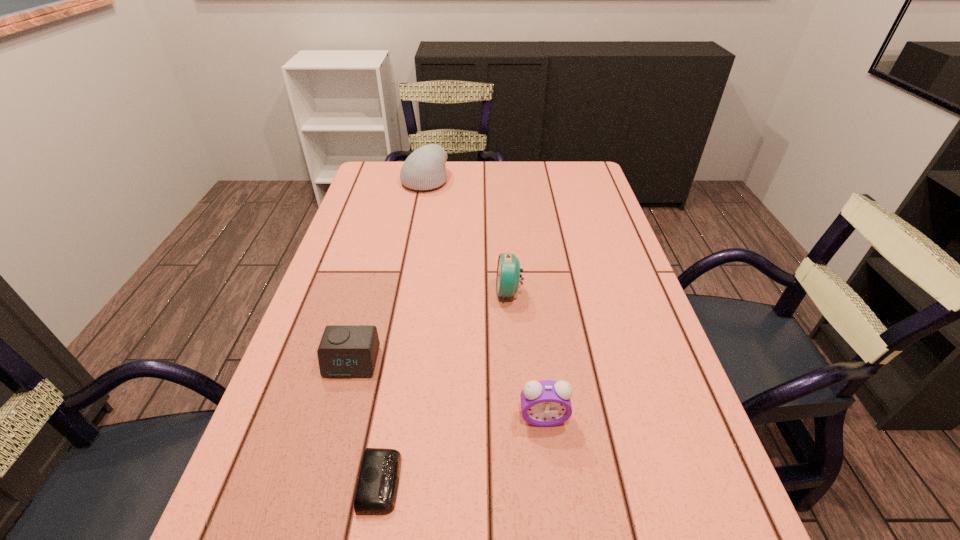
This screenshot has height=540, width=960. In order to click on blank region between the third farthest alarm clock and the beanie in this screenshot , I will do `click(484, 299)`.

Locate an element on the screen. This screenshot has width=960, height=540. blank region between the farthest object and the shortest object is located at coordinates (402, 331).

At what (x,y) coordinates should I click in order to perform the action: click on vacant area that lies between the farthest alarm clock and the nearest alarm clock. Please return your answer as a coordinate pair (x, y). Looking at the image, I should click on (444, 387).

Select which object appears as the third closest to the farthest alarm clock. Please provide its 2D coordinates. Your answer should be formatted as a tuple, i.e. [(x, y)], where the tuple contains the x and y coordinates of a point satisfying the conditions above.

[(376, 492)]

Image resolution: width=960 pixels, height=540 pixels. Identify the location of object that stands as the second closest to the third farthest alarm clock. (508, 275).

At what (x,y) coordinates should I click in order to perform the action: click on alarm clock that is the second closest to the shortest object. Please return your answer as a coordinate pair (x, y). Image resolution: width=960 pixels, height=540 pixels. Looking at the image, I should click on (545, 403).

Identify which alarm clock is the third nearest to the second nearest alarm clock. Please provide its 2D coordinates. Your answer should be formatted as a tuple, i.e. [(x, y)], where the tuple contains the x and y coordinates of a point satisfying the conditions above.

[(345, 351)]

Find the location of a particular element. free spot that satisfies the following two spatial constraints: 1. on the face of the third farthest alarm clock; 2. on the display of the nearest alarm clock is located at coordinates (551, 482).

Find the location of a particular element. vacant space that satisfies the following two spatial constraints: 1. on the front-facing side of the second farthest object; 2. on the front-facing side of the third nearest alarm clock is located at coordinates (514, 362).